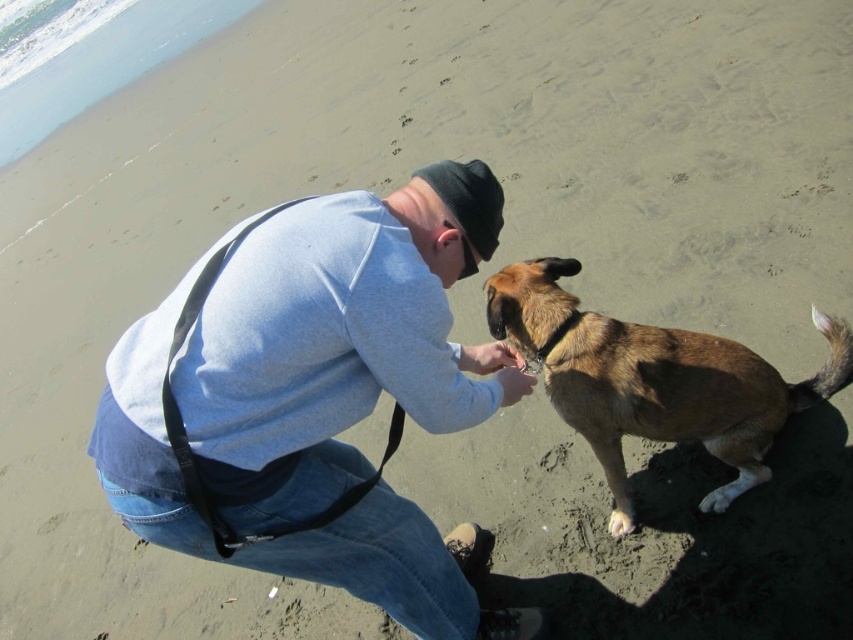
Does light blue sweater at center have a larger size compared to white fur paw at lower right?

Yes, light blue sweater at center is bigger than white fur paw at lower right.

Between point (234, 392) and point (614, 513), which one is positioned in front?

Point (234, 392) is in front.

Consider the image. Who is more forward, [421,230] or [619,515]?

Positioned in front is point [421,230].

Image resolution: width=853 pixels, height=640 pixels. I want to click on light blue sweater at center, so click(320, 396).

Does brown fur dog at lower right have a greater width compared to white fur paw at lower right?

Yes.

This screenshot has height=640, width=853. Describe the element at coordinates (654, 378) in the screenshot. I see `brown fur dog at lower right` at that location.

The width and height of the screenshot is (853, 640). Describe the element at coordinates (654, 378) in the screenshot. I see `brown fur dog at lower right` at that location.

Find the location of a particular element. This screenshot has width=853, height=640. brown fur dog at lower right is located at coordinates (654, 378).

Can you confirm if light blue sweater at center is taller than brown fur dog at lower right?

Correct, light blue sweater at center is much taller as brown fur dog at lower right.

Is light blue sweater at center positioned behind brown fur dog at lower right?

No.

Is point (296, 490) more distant than point (729, 376)?

No, it is in front of (729, 376).

At what (x,y) coordinates should I click in order to perform the action: click on light blue sweater at center. Please return your answer as a coordinate pair (x, y). The image size is (853, 640). Looking at the image, I should click on (320, 396).